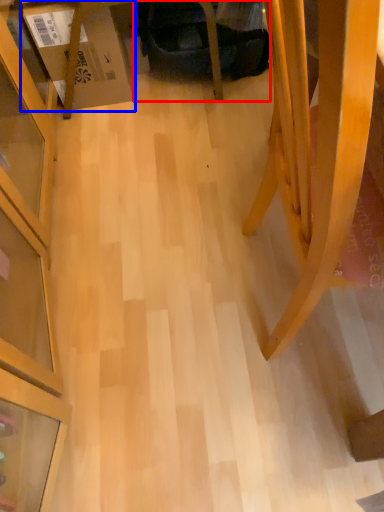
Question: Which object is further to the camera taking this photo, swivel chair (highlighted by a red box) or cardboard box (highlighted by a blue box)?

Choices:
 (A) swivel chair
 (B) cardboard box

Answer: (A)